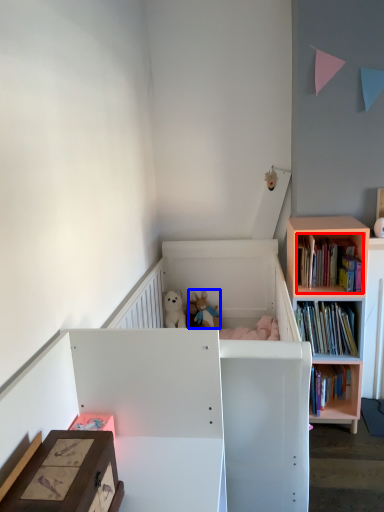
Question: Which of the following is the farthest to the observer, book (highlighted by a red box) or toy (highlighted by a blue box)?

Choices:
 (A) book
 (B) toy

Answer: (B)